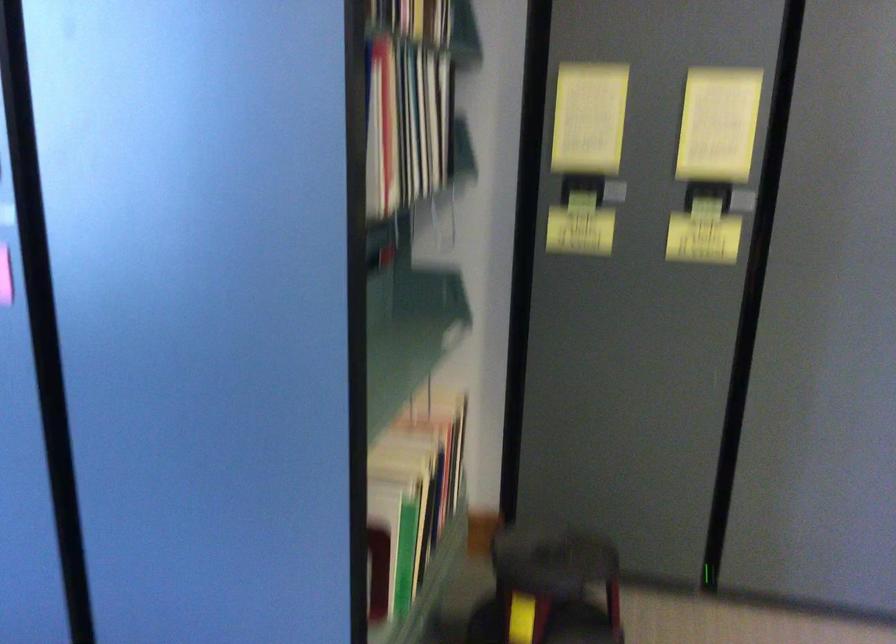
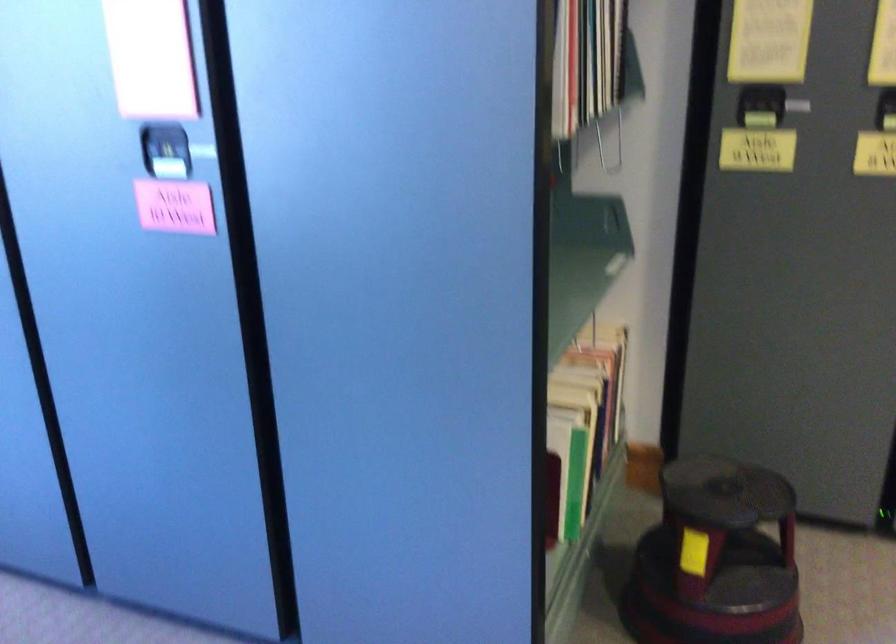
Locate, in the second image, the point that corresponds to the point at 415,489 in the first image.

(584, 413)